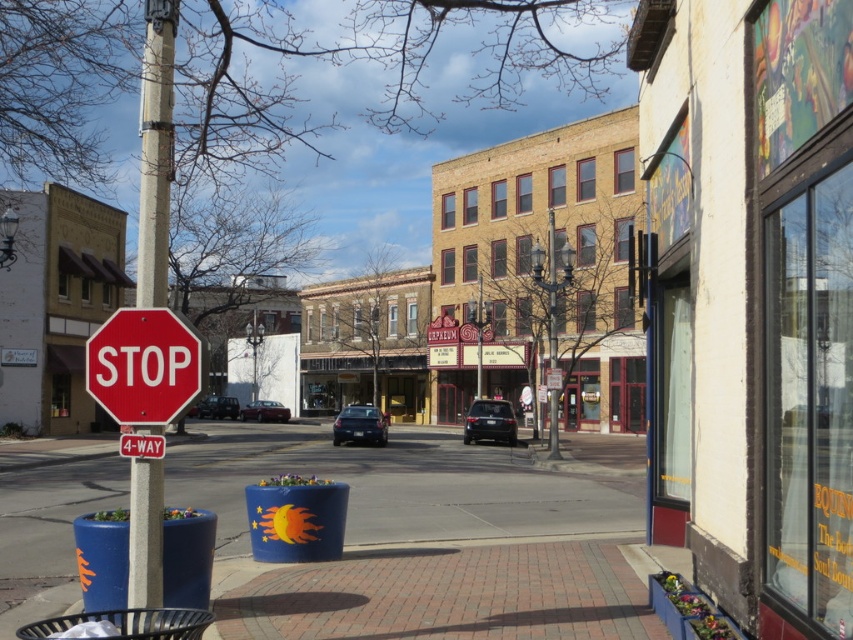
Does gray concrete pole at left appear on the right side of red matte stop sign at left?

Incorrect, gray concrete pole at left is not on the right side of red matte stop sign at left.

Consider the image. Who is more distant from viewer, [149,13] or [202,380]?

Positioned behind is point [149,13].

The height and width of the screenshot is (640, 853). I want to click on gray concrete pole at left, so click(155, 150).

Can you confirm if gray concrete pole at left is shorter than red plastic stop sign at center?

No, gray concrete pole at left is not shorter than red plastic stop sign at center.

Which is behind, point (155, 122) or point (163, 444)?

The point (155, 122) is more distant.

Where is `gray concrete pole at left`? gray concrete pole at left is located at coordinates (155, 150).

This screenshot has width=853, height=640. I want to click on gray concrete pole at left, so click(x=155, y=150).

The image size is (853, 640). Describe the element at coordinates (144, 365) in the screenshot. I see `red matte stop sign at left` at that location.

Is red matte stop sign at left to the right of red plastic stop sign at center from the viewer's perspective?

Indeed, red matte stop sign at left is positioned on the right side of red plastic stop sign at center.

Is point (183, 397) positioned before point (129, 451)?

Yes.

Locate an element on the screen. Image resolution: width=853 pixels, height=640 pixels. red matte stop sign at left is located at coordinates (144, 365).